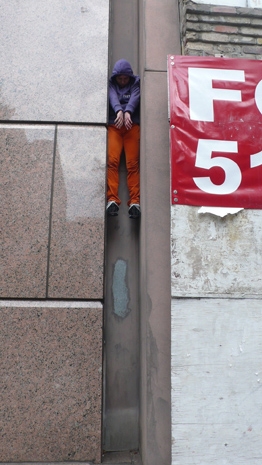
You are a GUI agent. You are given a task and a screenshot of the screen. Output one action in this format:
    pyautogui.click(x=<x>, y=<y>)
    Task: Click on the water stain
    The height and width of the screenshot is (465, 262).
    Given the screenshot: What is the action you would take?
    pyautogui.click(x=35, y=223), pyautogui.click(x=121, y=307)